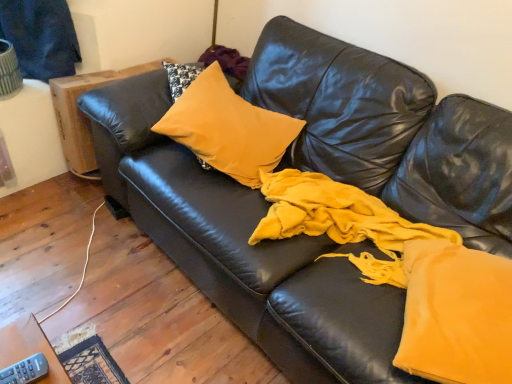
Question: Does wooden side table at left appear on the left side of gray plastic remote at lower left?

Choices:
 (A) yes
 (B) no

Answer: (A)

Question: Considering the relative sizes of wooden side table at left and gray plastic remote at lower left in the image provided, is wooden side table at left taller than gray plastic remote at lower left?

Choices:
 (A) yes
 (B) no

Answer: (A)

Question: Would you say wooden side table at left contains gray plastic remote at lower left?

Choices:
 (A) no
 (B) yes

Answer: (A)

Question: Is wooden side table at left located outside gray plastic remote at lower left?

Choices:
 (A) yes
 (B) no

Answer: (A)

Question: From the image's perspective, would you say wooden side table at left is shown under gray plastic remote at lower left?

Choices:
 (A) no
 (B) yes

Answer: (A)

Question: Can you confirm if wooden side table at left is thinner than gray plastic remote at lower left?

Choices:
 (A) yes
 (B) no

Answer: (B)

Question: Are gray plastic remote at lower left and wooden side table at left far apart?

Choices:
 (A) yes
 (B) no

Answer: (A)

Question: Is gray plastic remote at lower left directly adjacent to wooden side table at left?

Choices:
 (A) yes
 (B) no

Answer: (B)

Question: Does gray plastic remote at lower left turn towards wooden side table at left?

Choices:
 (A) no
 (B) yes

Answer: (A)

Question: Does gray plastic remote at lower left have a lesser width compared to wooden side table at left?

Choices:
 (A) yes
 (B) no

Answer: (A)

Question: Does gray plastic remote at lower left appear on the left side of wooden side table at left?

Choices:
 (A) yes
 (B) no

Answer: (B)

Question: Considering the relative sizes of gray plastic remote at lower left and wooden side table at left in the image provided, is gray plastic remote at lower left shorter than wooden side table at left?

Choices:
 (A) yes
 (B) no

Answer: (A)

Question: Is mustard velvet pillow at center taller than gray plastic remote at lower left?

Choices:
 (A) no
 (B) yes

Answer: (B)